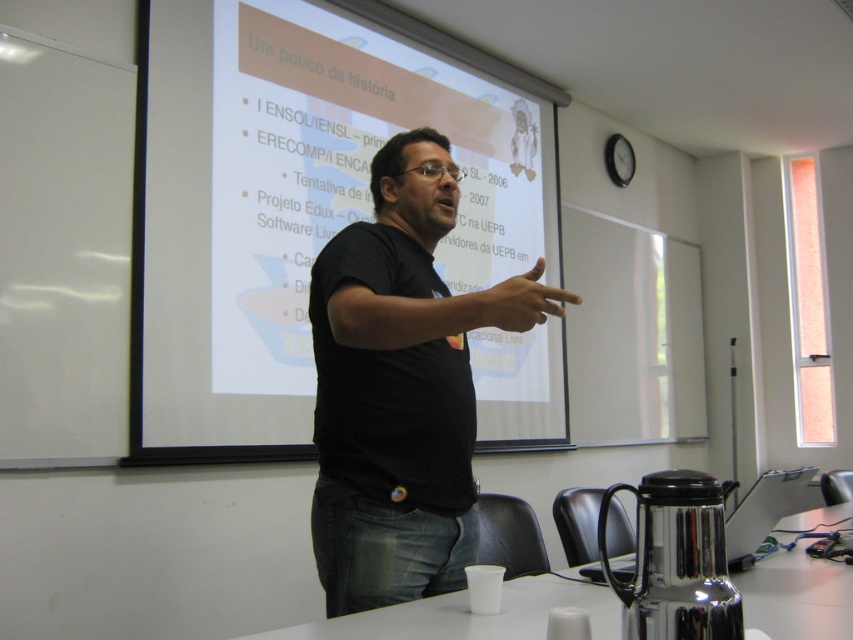
Is white matte projection screen at upper center to the right of matte black finger at center from the viewer's perspective?

No, white matte projection screen at upper center is not to the right of matte black finger at center.

Can you confirm if white matte projection screen at upper center is positioned above matte black finger at center?

Correct, white matte projection screen at upper center is located above matte black finger at center.

Locate an element on the screen. white matte projection screen at upper center is located at coordinates (294, 196).

This screenshot has width=853, height=640. Find the location of `white matte projection screen at upper center`. white matte projection screen at upper center is located at coordinates (294, 196).

Which is in front, point (216, 188) or point (393, 364)?

Point (393, 364)

Looking at this image, which is below, white matte projection screen at upper center or black matte shirt at center?

black matte shirt at center

In order to click on white matte projection screen at upper center in this screenshot , I will do `click(294, 196)`.

Does point (325, 301) come in front of point (492, 301)?

No, (325, 301) is further to viewer.

Who is shorter, black matte shirt at center or matte black finger at center?

matte black finger at center

You are a GUI agent. You are given a task and a screenshot of the screen. Output one action in this format:
    pyautogui.click(x=<x>, y=<y>)
    Task: Click on the black matte shirt at center
    Image resolution: width=853 pixels, height=640 pixels.
    Given the screenshot: What is the action you would take?
    pyautogui.click(x=401, y=387)

Identify the location of black matte shirt at center. The width and height of the screenshot is (853, 640). (401, 387).